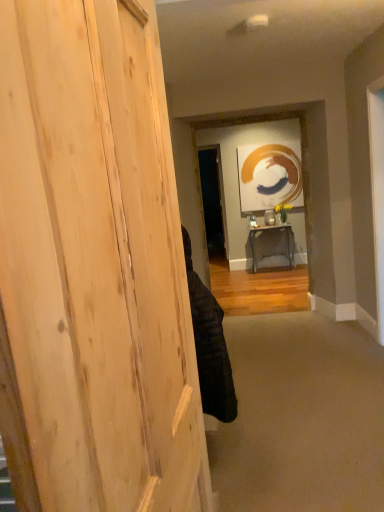
Question: In terms of size, does wooden table at center appear bigger or smaller than natural wood door at left?

Choices:
 (A) small
 (B) big

Answer: (A)

Question: Is wooden table at center in front of or behind natural wood door at left in the image?

Choices:
 (A) behind
 (B) front

Answer: (A)

Question: Which of these objects is positioned farthest from the wooden table at center?

Choices:
 (A) beige carpet at lower center
 (B) black fabric at center
 (C) natural wood door at left

Answer: (C)

Question: Considering the real-world distances, which object is farthest from the black fabric at center?

Choices:
 (A) beige carpet at lower center
 (B) natural wood door at left
 (C) wooden table at center

Answer: (C)